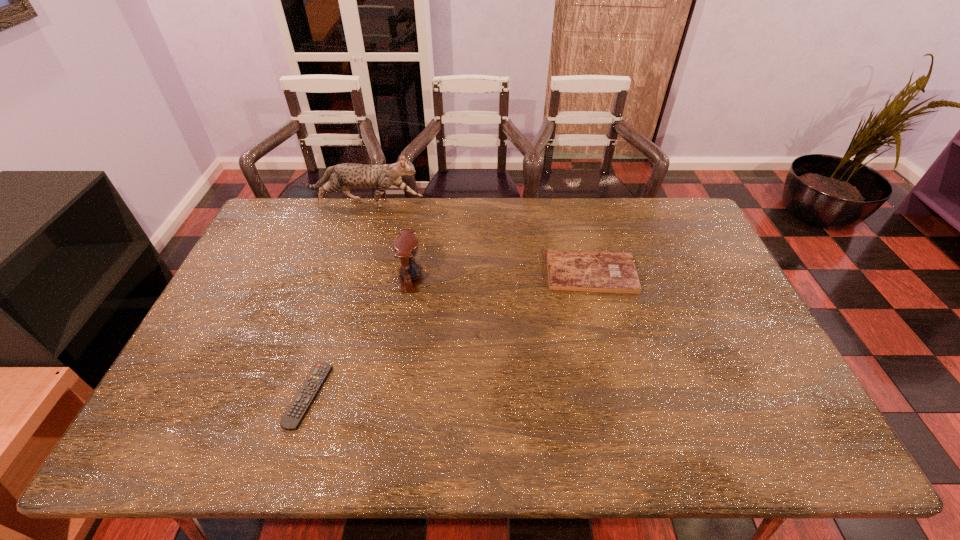
At what (x,y) coordinates should I click in order to perform the action: click on free point located 0.080m on the left of the shortest object. Please return your answer as a coordinate pair (x, y). The width and height of the screenshot is (960, 540). Looking at the image, I should click on (258, 395).

You are a GUI agent. You are given a task and a screenshot of the screen. Output one action in this format:
    pyautogui.click(x=<x>, y=<y>)
    Task: Click on the object that is at the far edge
    This screenshot has width=960, height=540.
    Given the screenshot: What is the action you would take?
    pyautogui.click(x=347, y=175)

Find the location of a particular element. object that is at the near edge is located at coordinates (293, 417).

Where is `object that is at the left edge`? object that is at the left edge is located at coordinates (347, 175).

The width and height of the screenshot is (960, 540). I want to click on object located in the far left corner section of the desktop, so click(x=347, y=175).

Image resolution: width=960 pixels, height=540 pixels. In the image, there is a desktop. Identify the location of vacant area at the far edge. (573, 218).

The height and width of the screenshot is (540, 960). Find the location of `vacant space at the near edge of the desktop`. vacant space at the near edge of the desktop is located at coordinates (437, 438).

At what (x,y) coordinates should I click in order to perform the action: click on free space at the left edge. Please return your answer as a coordinate pair (x, y). The image size is (960, 540). Looking at the image, I should click on (273, 241).

Where is `free region at the right edge`? This screenshot has height=540, width=960. free region at the right edge is located at coordinates (662, 243).

The image size is (960, 540). In the image, there is a desktop. What are the coordinates of `free space at the far right corner` in the screenshot? It's located at (684, 235).